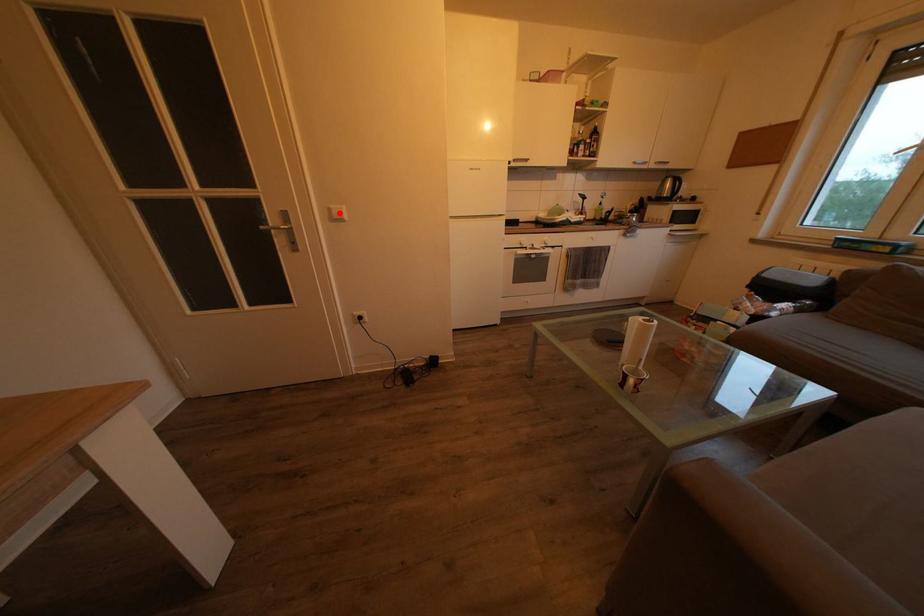
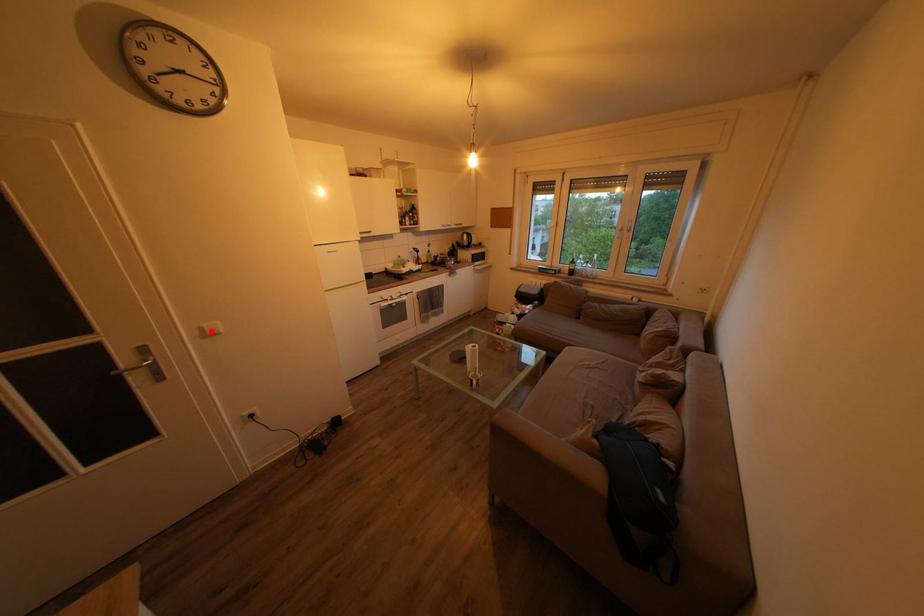
I am providing you with two images of the same scene from different viewpoints. A red point is marked on the first image and another point is marked on the second image. Are the points marked in image1 and image2 representing the same 3D position?

Yes